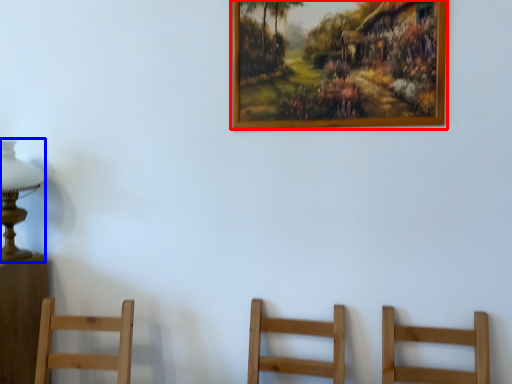
Question: Which point is closer to the camera, picture frame (highlighted by a red box) or table lamp (highlighted by a blue box)?

Choices:
 (A) picture frame
 (B) table lamp

Answer: (A)